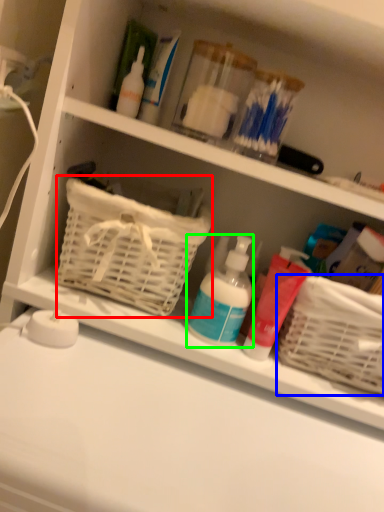
Question: Which object is the closest to the basket (highlighted by a red box)? Choose among these: basket (highlighted by a blue box) or cleaning product (highlighted by a green box).

Choices:
 (A) basket
 (B) cleaning product

Answer: (B)